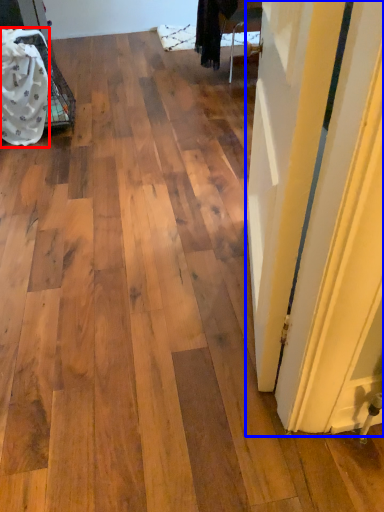
Question: Which object is further to the camera taking this photo, material (highlighted by a red box) or door (highlighted by a blue box)?

Choices:
 (A) material
 (B) door

Answer: (A)